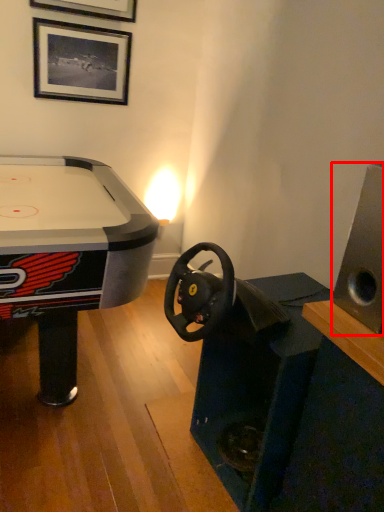
Question: From the image's perspective, what is the correct spatial relationship of speaker (annotated by the red box) in relation to picture frame?

Choices:
 (A) above
 (B) below

Answer: (B)